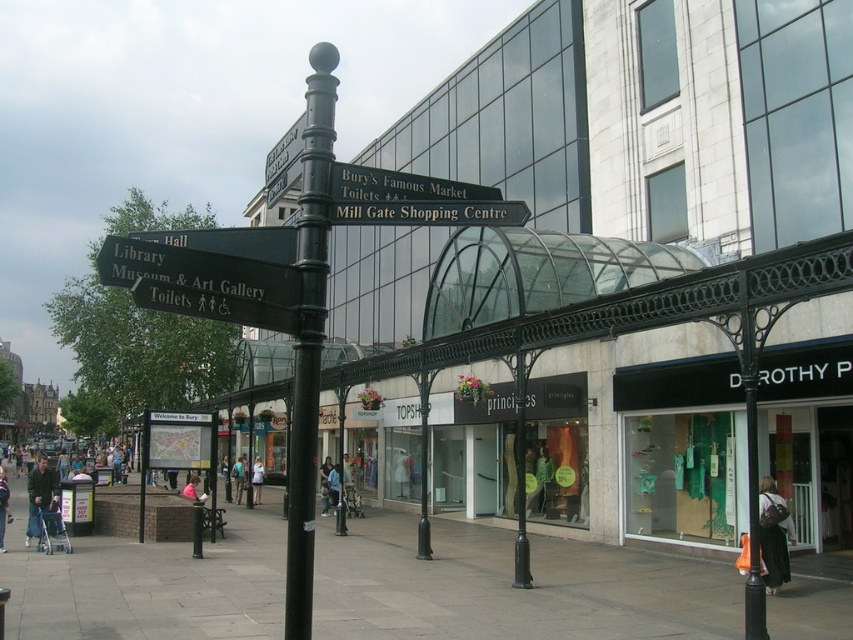
You are a street performer planning to set up a small stage near the black metal pole at center and the light blue jeans at lower left. Since the stage requires a width of 1.2 meters, can both objects fit side by side on the sidewalk without overlapping?

The black metal pole at center is narrower than the light blue jeans at lower left. However, without knowing the exact widths of both objects, it is impossible to determine if their combined width would exceed 1.2 meters. Additional measurements are needed.

You are a pedestrian walking on the sidewalk near the black metal signpost. You notice two items of clothing in the scene. The first is light blue jeans at lower left and the second is light blue denim jacket at center. Which clothing item is positioned higher up in the image?

The light blue jeans at lower left is located above the light blue denim jacket at center, so the jeans are positioned higher up in the image.

You are standing at the signpost in the scene. There is a point marked at coordinates (54, 506) which corresponds to an object in the lower left. What object is located at that point?

The point at coordinates (54, 506) marks dark blue jeans at lower left.